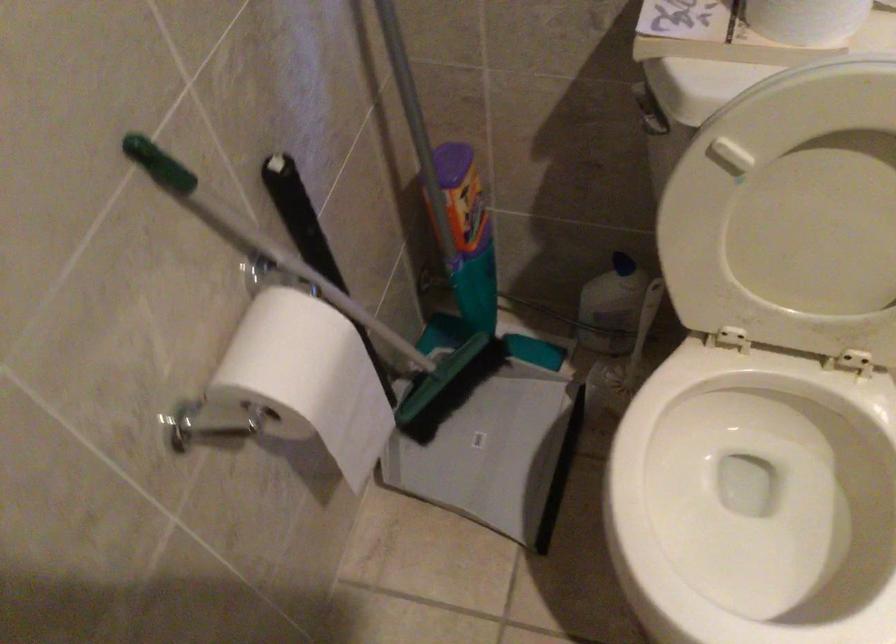
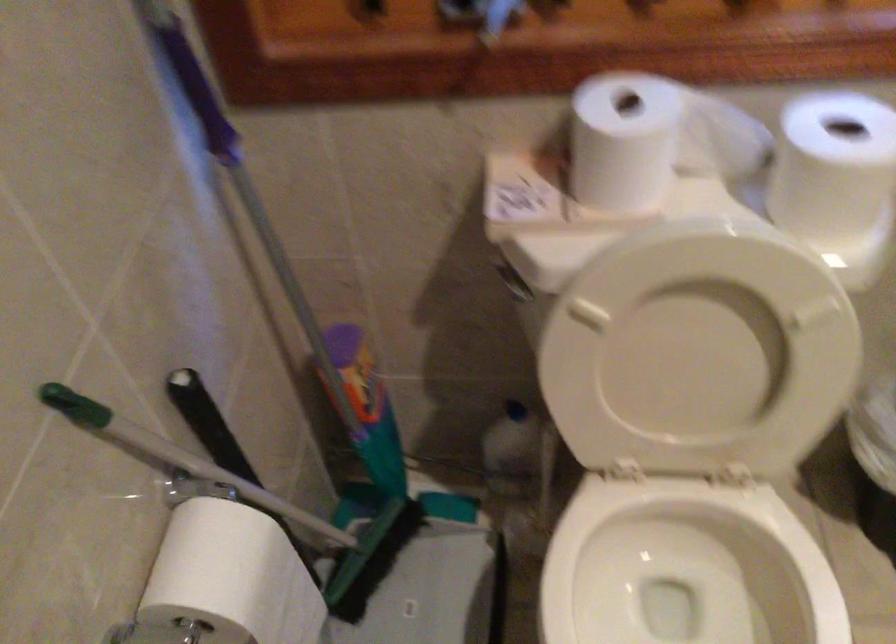
Find the pixel in the second image that matches [428,389] in the first image.

(352, 564)